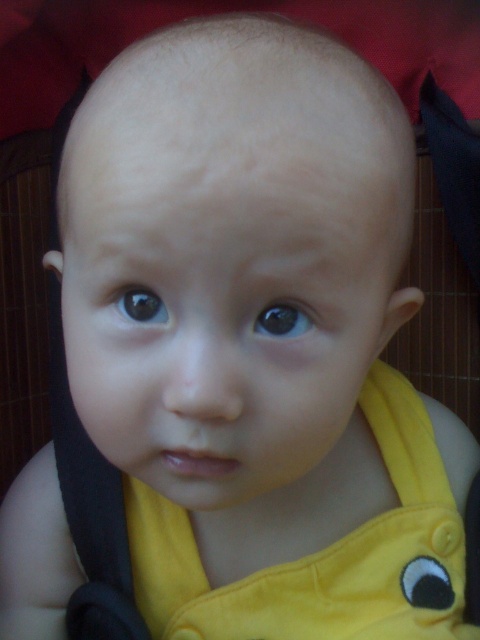
You are a photographer taking a portrait of a baby. You notice the baby has two eyes, the brown glossy eye at center and the black glossy eye at center. Which eye is positioned lower on the baby?

The brown glossy eye at center is located below the black glossy eye at center, so the brown glossy eye at center is positioned lower on the baby.